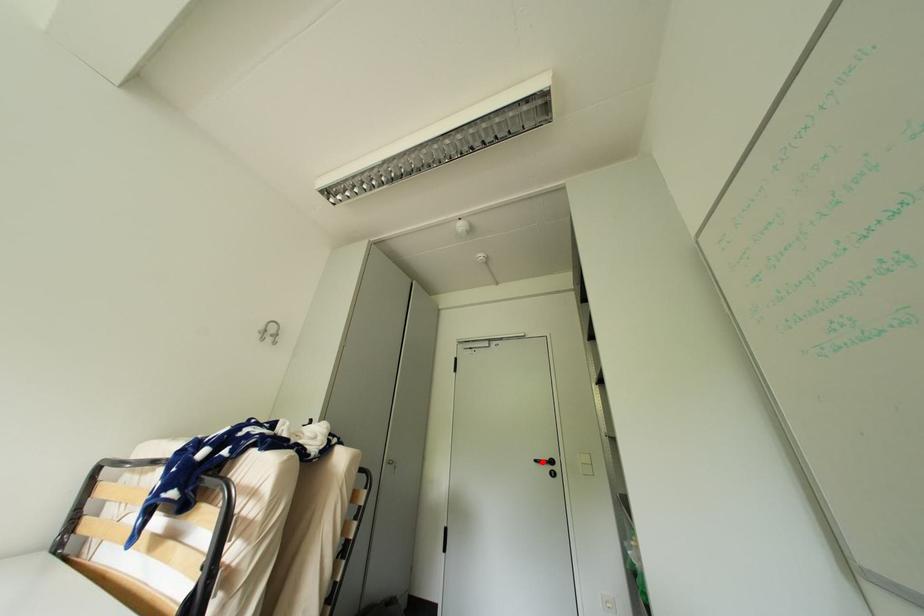
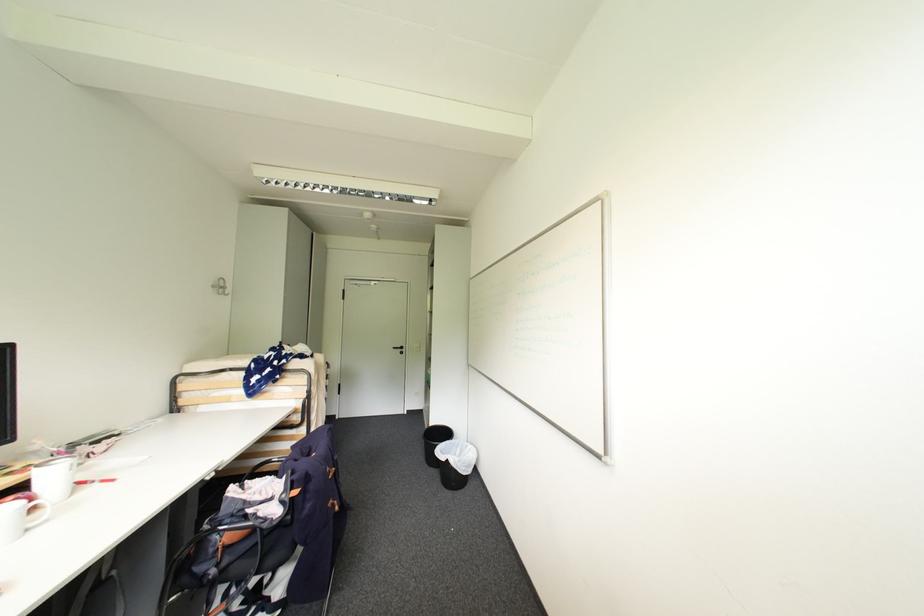
Locate, in the second image, the point that corresponds to the highlighted location in the first image.

(400, 349)